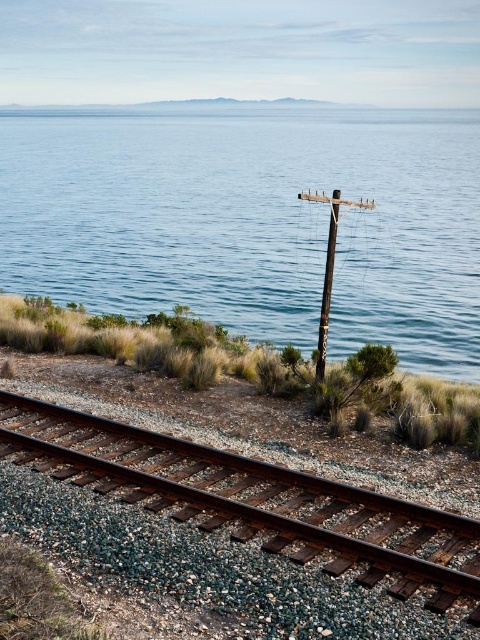
Question: Does blue water at center have a greater width compared to wooden pole at center?

Choices:
 (A) yes
 (B) no

Answer: (A)

Question: Which of the following is the closest to the observer?

Choices:
 (A) (284, 509)
 (B) (44, 285)

Answer: (A)

Question: Which of the following is the farthest from the observer?

Choices:
 (A) (417, 292)
 (B) (204, 484)

Answer: (A)

Question: Which object is farther from the camera taking this photo?

Choices:
 (A) brown wooden telegraph pole at center
 (B) wooden pole at center
 (C) blue water at center
 (D) rusty metal track at lower center

Answer: (C)

Question: In this image, where is rusty metal track at lower center located relative to brown wooden telegraph pole at center?

Choices:
 (A) below
 (B) above

Answer: (A)

Question: Does rusty metal track at lower center lie in front of brown wooden telegraph pole at center?

Choices:
 (A) no
 (B) yes

Answer: (B)